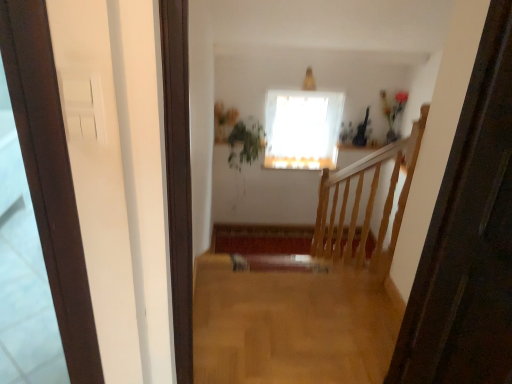
This screenshot has width=512, height=384. What are the coordinates of `free space above light brown wood floor at center (from a real-world perspective)` in the screenshot? It's located at (291, 320).